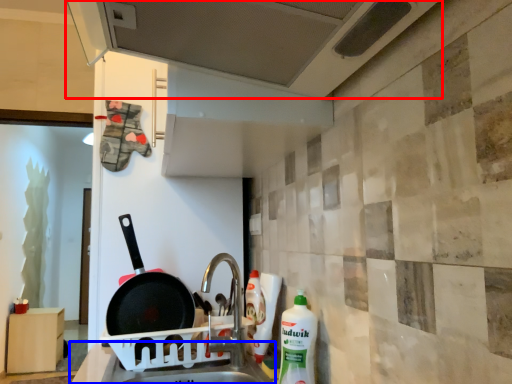
Question: Among these objects, which one is farthest to the camera, exhaust hood (highlighted by a red box) or counter top (highlighted by a blue box)?

Choices:
 (A) exhaust hood
 (B) counter top

Answer: (B)